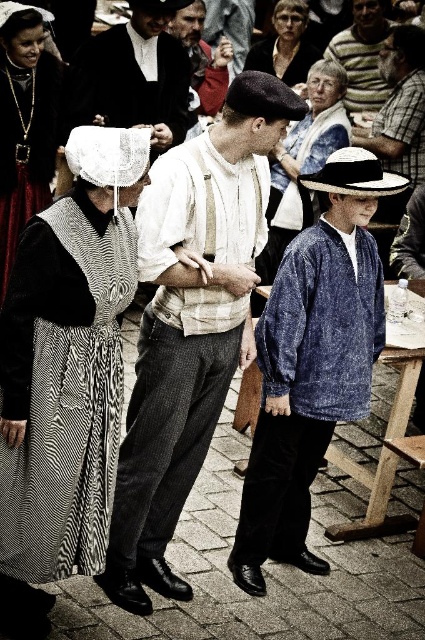
You are a photographer trying to capture a group photo of the velvet black dress at left and the white straw hat at center. Since you want both subjects to be in the frame, which direction should you move your camera to include both?

Since the velvet black dress at left is to the left of white straw hat at center, you should move your camera to the left to include both subjects in the frame.

You are observing a historical reenactment event from a distance. You notice two items in the scene described as the velvet black dress at left and the white straw hat at center. Based on their positions, which object appears closer to you?

The velvet black dress at left appears closer because it is taller in the scene than the white straw hat at center, indicating it is positioned nearer to the observer.

You are standing at the center of the cobblestone street and want to approach the velvet black dress at left. Which direction should you move to reach it?

Since the velvet black dress at left is located at point 0.647 on the x axis and 0.165 on the y axis, you should move to the left and slightly forward to reach it.